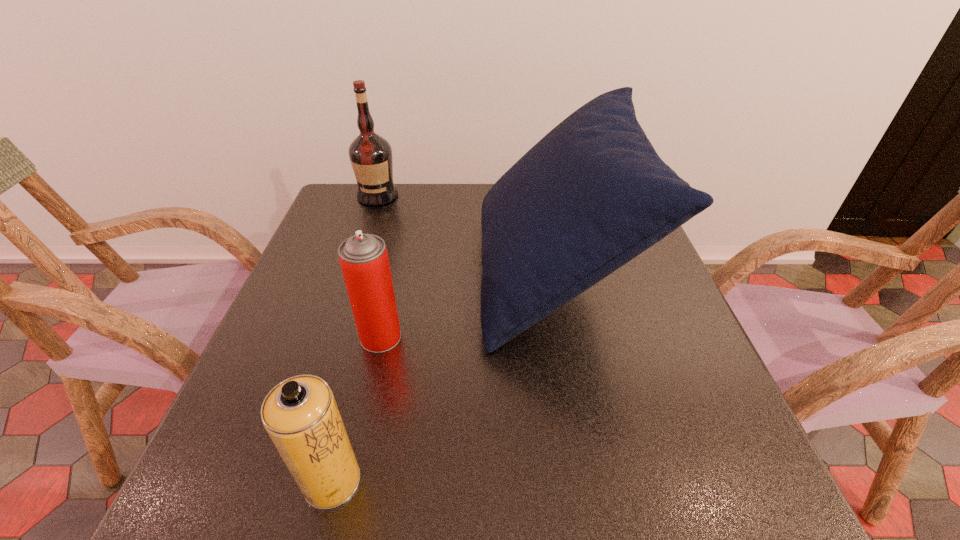
The width and height of the screenshot is (960, 540). I want to click on free point at the far left corner, so click(x=354, y=192).

At what (x,y) coordinates should I click in order to perform the action: click on free space that is in between the cushion and the nearest object. Please return your answer as a coordinate pair (x, y). The width and height of the screenshot is (960, 540). Looking at the image, I should click on (443, 377).

This screenshot has height=540, width=960. In order to click on vacant space in between the cushion and the farther aerosol can in this screenshot , I will do `click(467, 306)`.

Locate an element on the screen. Image resolution: width=960 pixels, height=540 pixels. vacant area that lies between the cushion and the farther aerosol can is located at coordinates (467, 306).

I want to click on vacant area between the farthest object and the cushion, so click(x=466, y=235).

This screenshot has height=540, width=960. I want to click on free space between the cushion and the nearest object, so (x=443, y=377).

Locate an element on the screen. free point between the farther aerosol can and the nearest object is located at coordinates (356, 409).

Locate an element on the screen. empty space that is in between the nearest object and the cushion is located at coordinates (443, 377).

Identify which object is the third closest to the cushion. Please provide its 2D coordinates. Your answer should be formatted as a tuple, i.e. [(x, y)], where the tuple contains the x and y coordinates of a point satisfying the conditions above.

[(300, 414)]

Where is `object that is the closest to the farther aerosol can`? Image resolution: width=960 pixels, height=540 pixels. object that is the closest to the farther aerosol can is located at coordinates [x=591, y=195].